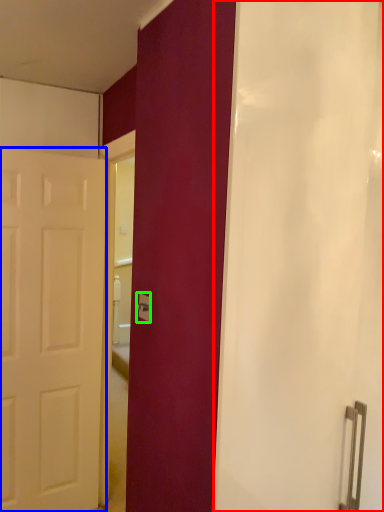
Question: Based on their relative distances, which object is farther from shower curtain (highlighted by a red box)? Choose from door (highlighted by a blue box) and electric outlet (highlighted by a green box).

Choices:
 (A) door
 (B) electric outlet

Answer: (A)